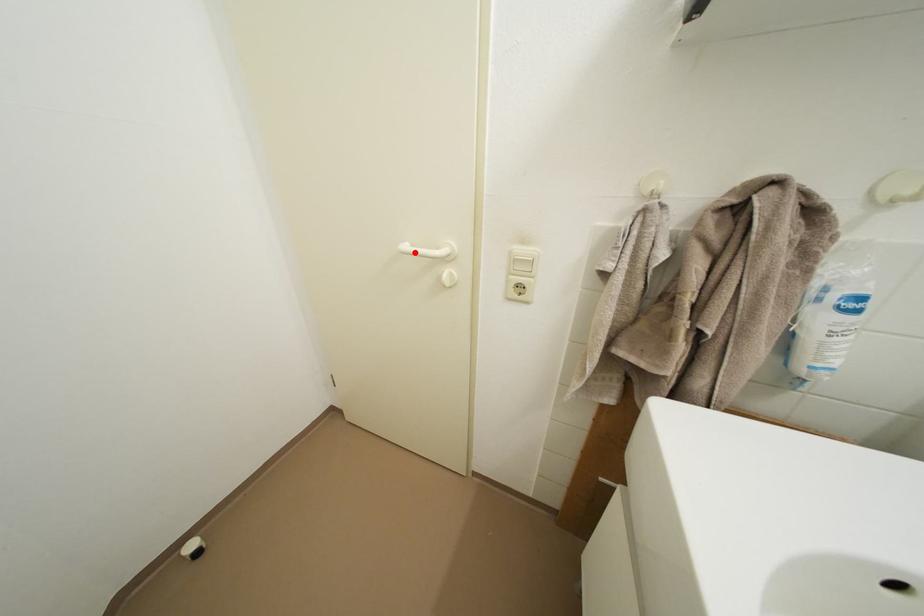
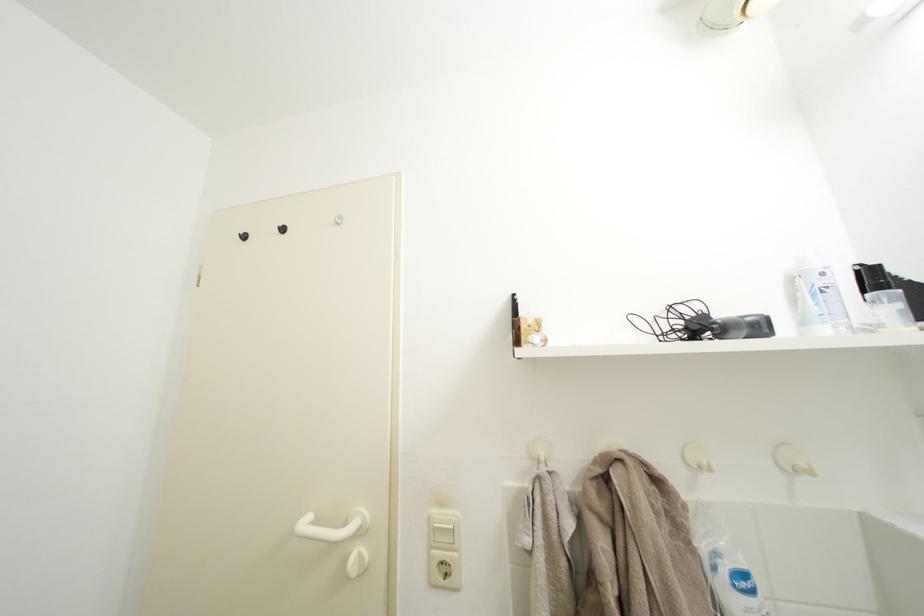
In the second image, find the point that corresponds to the highlighted location in the first image.

(314, 528)